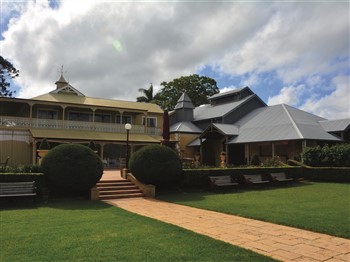
Image resolution: width=350 pixels, height=262 pixels. I want to click on benches, so click(222, 185), click(266, 179), click(283, 177), click(13, 196).